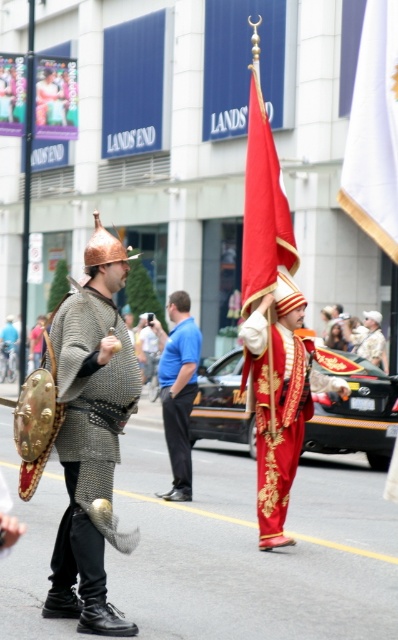
You are a costume designer observing the two individuals in the scene. Which costume is visible on top when looking at the chainmail armor at center and the blue cotton shirt at center?

The chainmail armor at center is positioned over the blue cotton shirt at center, making it the visible top layer.

You are a photographer positioned at the blue cotton shirt at center. You want to capture a photo of the white fabric flag at upper right. Considering the distance between them, can you estimate how far you need to move forward to get the flag in frame?

The white fabric flag at upper right is 6.82 meters away from the blue cotton shirt at center. To capture the flag in frame, you would need to move forward approximately 6.82 meters from your current position at the blue cotton shirt at center.

You are standing in the middle of the street during the parade. You notice two points in the scene. The first point is at coordinates point [105,620] and the second is at point [181,440]. Which point is closer to you?

Point [105,620] is closer to the viewer than point [181,440].